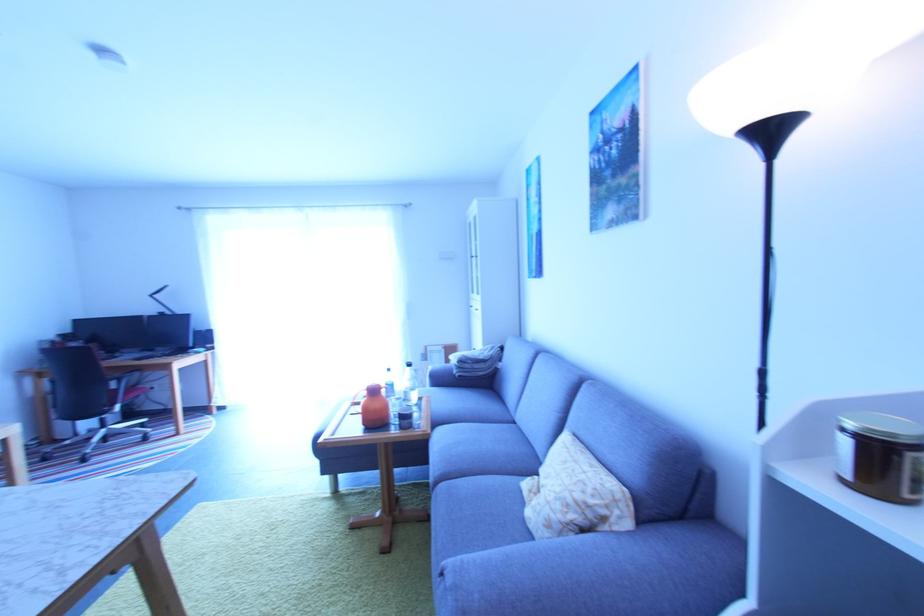
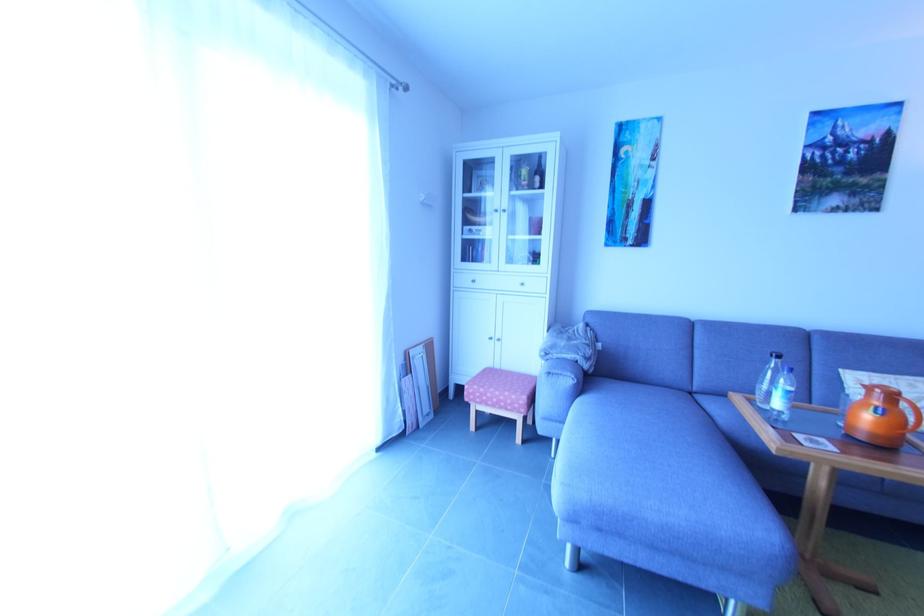
Where in the second image is the point corresponding to (427,353) from the first image?

(406, 362)